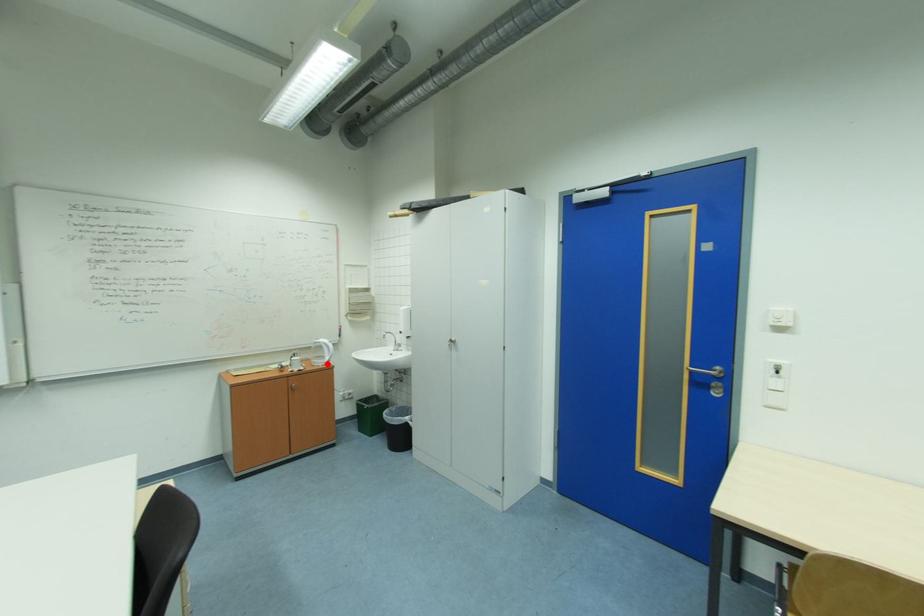
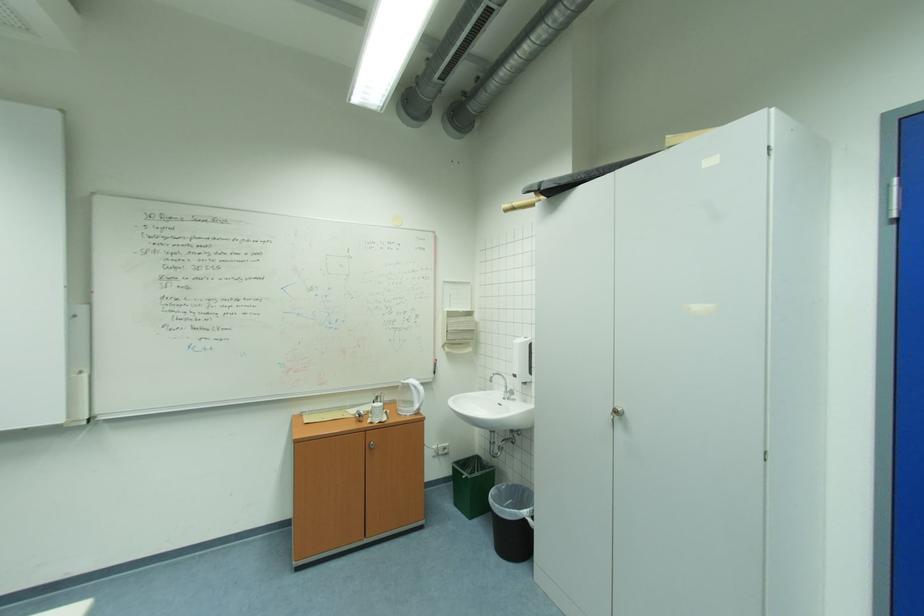
Question: A red point is marked in image1. In image2, is the corresponding 3D point closer to the camera or farther? Reply with the corresponding letter.

Choices:
 (A) The corresponding 3D point is closer.
 (B) The corresponding 3D point is farther.

Answer: (B)